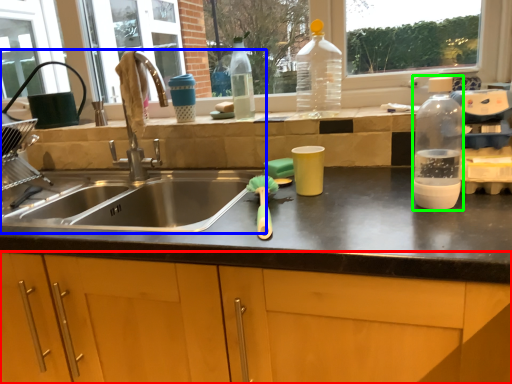
Question: Which object is the closest to the cabinetry (highlighted by a red box)? Choose among these: sink (highlighted by a blue box) or bottle (highlighted by a green box).

Choices:
 (A) sink
 (B) bottle

Answer: (A)